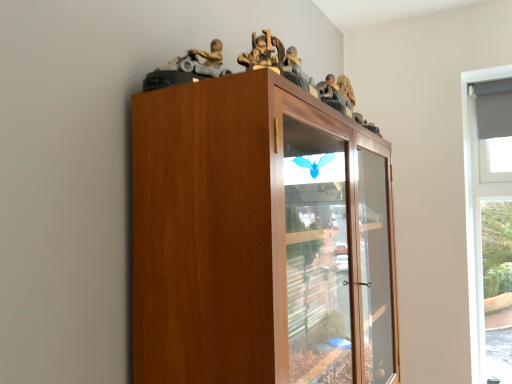
What do you see at coordinates (260, 238) in the screenshot? I see `brown wooden cupboard at upper center` at bounding box center [260, 238].

Locate an element on the screen. brown wooden cupboard at upper center is located at coordinates pos(260,238).

Where is `brown wooden cupboard at upper center`? The height and width of the screenshot is (384, 512). brown wooden cupboard at upper center is located at coordinates [x=260, y=238].